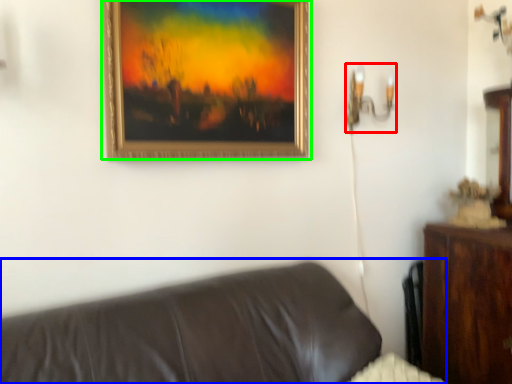
Question: Considering the real-world distances, which object is closest to table lamp (highlighted by a red box)? studio couch (highlighted by a blue box) or picture frame (highlighted by a green box).

Choices:
 (A) studio couch
 (B) picture frame

Answer: (B)